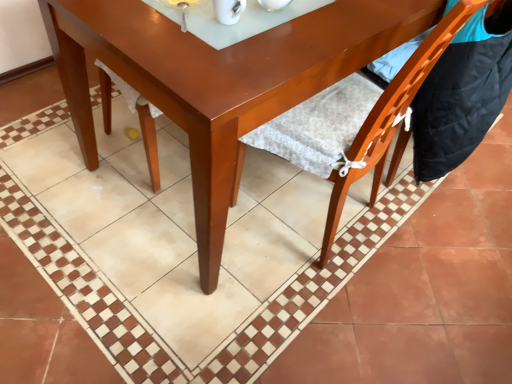
Locate an element on the screen. The width and height of the screenshot is (512, 384). free point to the right of wooden chair at lower right, arranged as the first chair when viewed from the left is located at coordinates (426, 251).